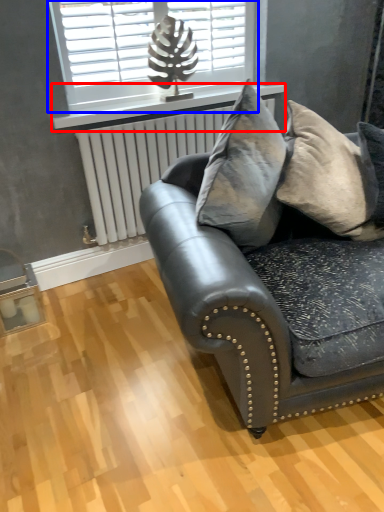
Question: Which point is further to the camera, window sill (highlighted by a red box) or window (highlighted by a blue box)?

Choices:
 (A) window sill
 (B) window

Answer: (A)